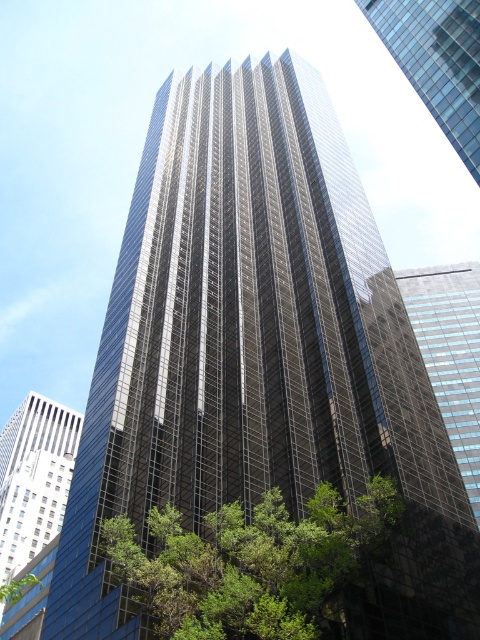
Question: Is green leafy tree at center wider than glassy reflective skyscraper at upper right?

Choices:
 (A) no
 (B) yes

Answer: (B)

Question: Among these objects, which one is farthest from the camera?

Choices:
 (A) green leafy tree at center
 (B) glassy reflective skyscraper at upper right

Answer: (B)

Question: Which of the following is the closest to the observer?

Choices:
 (A) (468, 168)
 (B) (163, 573)

Answer: (B)

Question: Can you confirm if green leafy tree at center is bigger than glassy reflective skyscraper at upper right?

Choices:
 (A) no
 (B) yes

Answer: (A)

Question: Which object is farther from the camera taking this photo?

Choices:
 (A) glassy reflective skyscraper at upper right
 (B) green leafy tree at center

Answer: (A)

Question: Does green leafy tree at center appear over glassy reflective skyscraper at upper right?

Choices:
 (A) no
 (B) yes

Answer: (A)